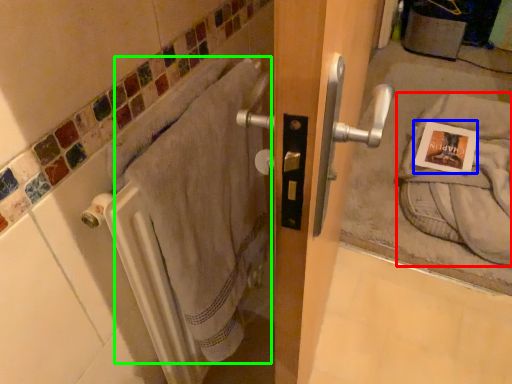
Question: Considering the real-world distances, which object is farthest from bath towel (highlighted by a red box)? postcard (highlighted by a blue box) or bath towel (highlighted by a green box)?

Choices:
 (A) postcard
 (B) bath towel

Answer: (B)